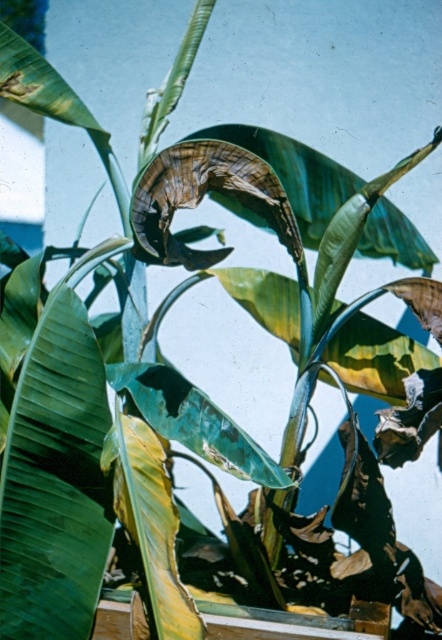
You are an artist trying to paint the banana plant. You have two leaves in front of you, the green matte leaf at center and the green matte banana leaf at center. Which leaf should you choose if you want to paint a wider leaf?

The green matte banana leaf at center is wider than the green matte leaf at center, so you should choose the green matte banana leaf at center for painting a wider leaf.

You are standing in front of a banana plant with large leaves. There is a point at coordinates (54,481) on the image. Which object from the list below is located at that point? Choose from the following objects in the scene described in the scene description above. The objects are green matte leaf at center. Please answer with the object label exactly as given in the options.

The point at coordinates (54,481) corresponds to the green matte leaf at center.